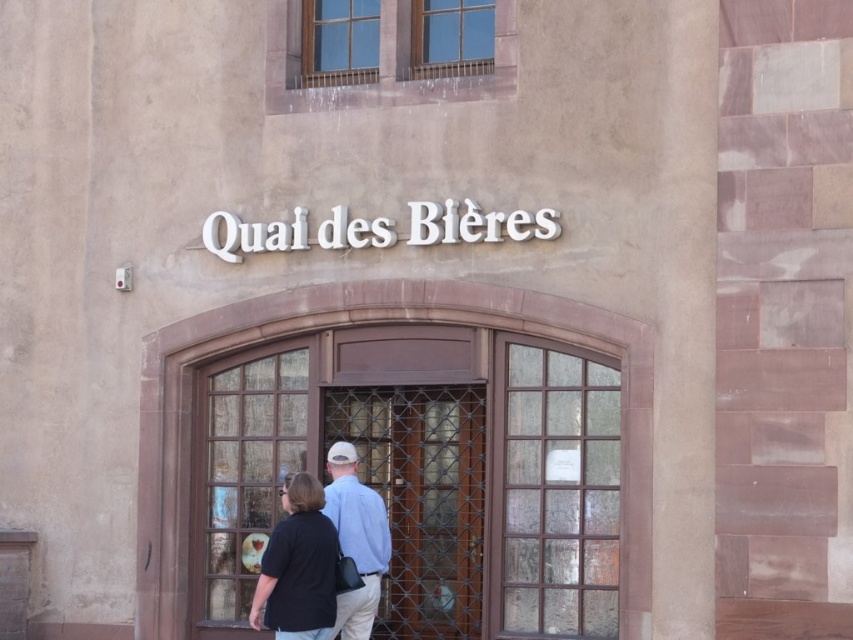
You are a visitor standing in front of the building and see the brown wooden door at center and the light blue shirt at center. Which object is higher up in the scene?

The brown wooden door at center is located above the light blue shirt at center, so it is higher up in the scene.